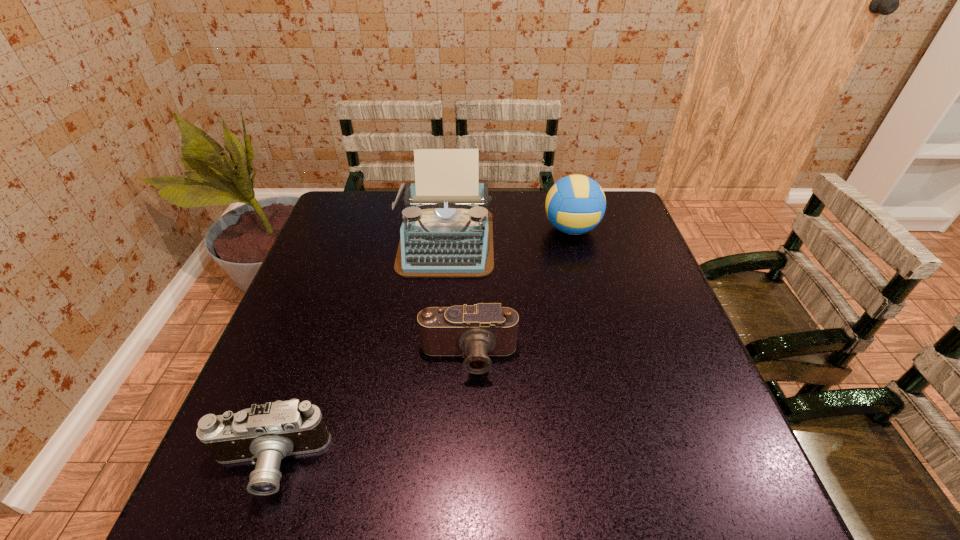
I want to click on free point at the right edge, so click(x=654, y=289).

The width and height of the screenshot is (960, 540). Identify the location of blank space at the far left corner of the desktop. (335, 221).

Image resolution: width=960 pixels, height=540 pixels. In the image, there is a desktop. In order to click on vacant region at the near left corner in this screenshot , I will do tap(228, 515).

The height and width of the screenshot is (540, 960). Identify the location of free point at the near right corner. (763, 498).

Find the location of a particular element. This screenshot has height=540, width=960. free space between the nearer camera and the right camera is located at coordinates (369, 410).

Where is `unoccupied position between the tallest object and the third shortest object`? This screenshot has height=540, width=960. unoccupied position between the tallest object and the third shortest object is located at coordinates (508, 234).

At what (x,y) coordinates should I click in order to perform the action: click on free spot between the volleyball and the nearest object. Please return your answer as a coordinate pair (x, y). This screenshot has width=960, height=540. Looking at the image, I should click on (420, 347).

This screenshot has height=540, width=960. What are the coordinates of `empty space that is in between the rightmost object and the nearest object` in the screenshot? It's located at click(x=420, y=347).

The width and height of the screenshot is (960, 540). What are the coordinates of `vacant area that lies between the left camera and the tallest object` in the screenshot? It's located at (357, 352).

Where is `unoccupied position between the second tallest object and the typewriter`? The height and width of the screenshot is (540, 960). unoccupied position between the second tallest object and the typewriter is located at coordinates (508, 234).